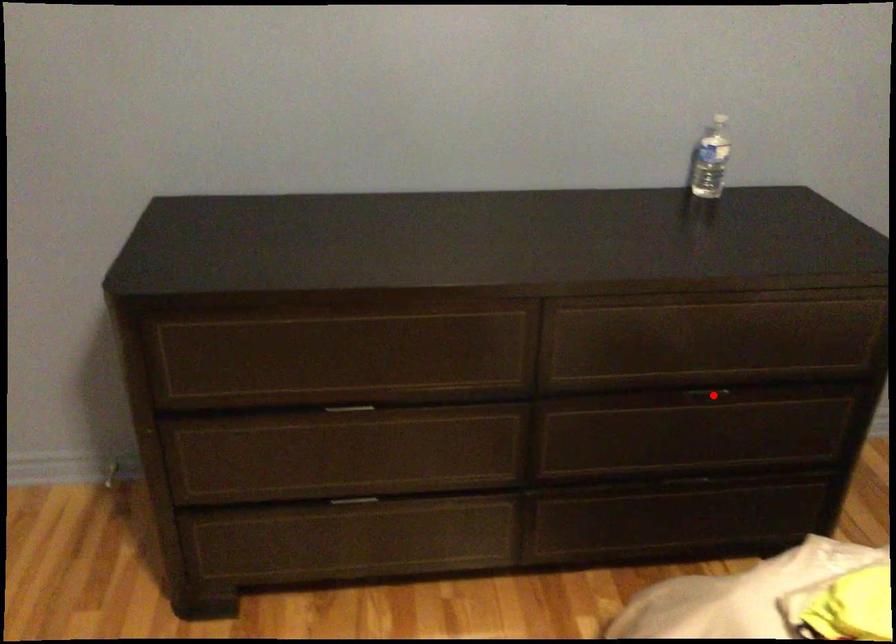
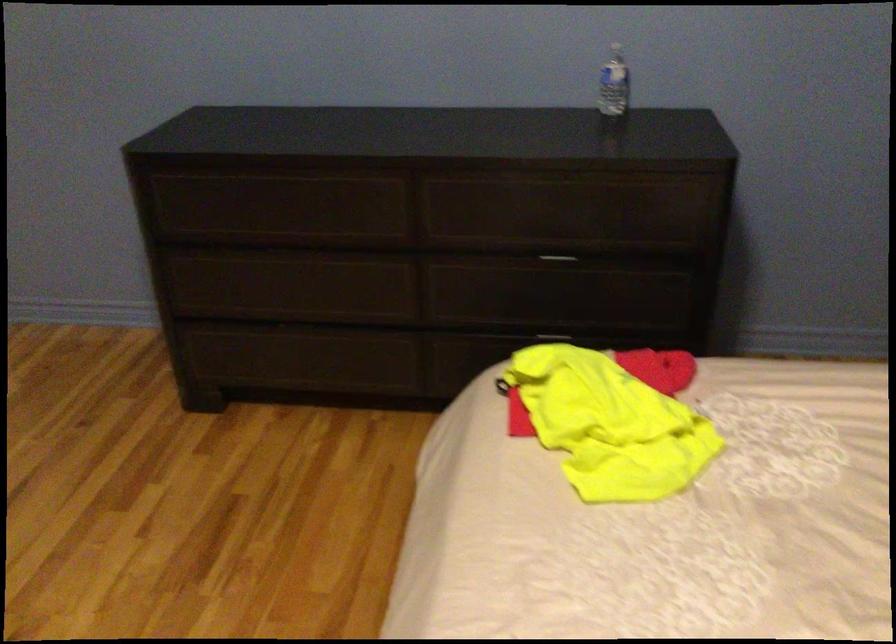
The point at the highlighted location is marked in the first image. Where is the corresponding point in the second image?

(557, 260)